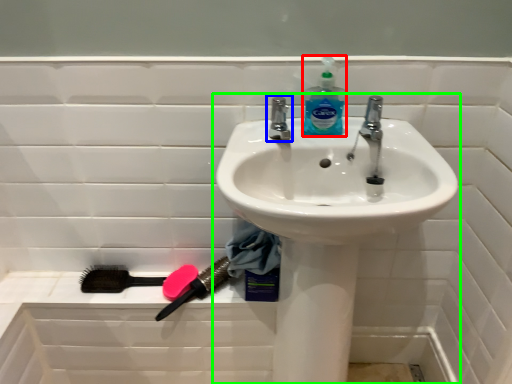
Question: Based on their relative distances, which object is farther from cleaning product (highlighted by a red box)? Choose from tap (highlighted by a blue box) and sink (highlighted by a green box).

Choices:
 (A) tap
 (B) sink

Answer: (B)